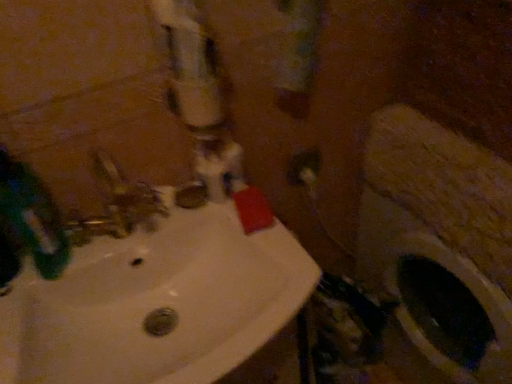
I want to click on white glossy water pipe at upper center, so click(199, 96).

The width and height of the screenshot is (512, 384). Identify the location of white glossy sink at center. (157, 255).

In order to click on white glossy water pipe at upper center in this screenshot , I will do `click(199, 96)`.

Does green matte toothbrush at left lie in front of white glossy sink at center?

No, green matte toothbrush at left is further to the viewer.

Find the location of a particular element. This screenshot has width=512, height=384. sink in front of the green matte toothbrush at left is located at coordinates (157, 255).

Between green matte toothbrush at left and white glossy sink at center, which one has smaller size?

green matte toothbrush at left.

Consider the image. From a real-world perspective, between white glossy water pipe at upper center and white glossy sink at center, who is vertically higher?

A: white glossy water pipe at upper center, from a real-world perspective.

Locate an element on the screen. sink in front of the white glossy water pipe at upper center is located at coordinates (157, 255).

Is point (194, 89) farther from viewer compared to point (199, 220)?

No.

Is white glossy water pipe at upper center inside or outside of white glossy sink at center?

white glossy water pipe at upper center is spatially situated outside white glossy sink at center.

Is matte white outlet at center at the left side of white glossy sink at center?

No.

From the picture: From a real-world perspective, is matte white outlet at center above or below white glossy sink at center?

matte white outlet at center is situated lower than white glossy sink at center in the real world.

Is matte white outlet at center thinner than white glossy sink at center?

Yes.

From a real-world perspective, is white glossy water pipe at upper center physically located above or below matte white outlet at center?

From a real-world perspective, white glossy water pipe at upper center is physically above matte white outlet at center.

Is white glossy water pipe at upper center positioned beyond the bounds of matte white outlet at center?

That's correct, white glossy water pipe at upper center is outside of matte white outlet at center.

At what (x,y) coordinates should I click in order to perform the action: click on electric outlet behind the white glossy water pipe at upper center. Please return your answer as a coordinate pair (x, y). Looking at the image, I should click on (303, 166).

From the image's perspective, relative to matte white outlet at center, is white glossy water pipe at upper center above or below?

white glossy water pipe at upper center is situated higher than matte white outlet at center in the image.

Can you confirm if matte white outlet at center is wider than green matte toothbrush at left?

No.

Does matte white outlet at center have a larger size compared to green matte toothbrush at left?

No.

From a real-world perspective, is matte white outlet at center over green matte toothbrush at left?

No, from a real-world perspective, matte white outlet at center is not above green matte toothbrush at left.

Is matte white outlet at center further to camera compared to green matte toothbrush at left?

Yes, matte white outlet at center is further from the camera.

Consider the image. Is white glossy sink at center with matte white outlet at center?

No, white glossy sink at center is not with matte white outlet at center.

Between white glossy sink at center and matte white outlet at center, which one has larger size?

Bigger between the two is white glossy sink at center.

Does white glossy sink at center have a lesser height compared to matte white outlet at center?

No, white glossy sink at center is not shorter than matte white outlet at center.

How many degrees apart are the facing directions of white glossy sink at center and matte white outlet at center?

The angle between the facing direction of white glossy sink at center and the facing direction of matte white outlet at center is 0.63 degrees.

Between white glossy sink at center and green matte toothbrush at left, which one appears on the right side from the viewer's perspective?

white glossy sink at center is more to the right.

Which point is more forward, (223, 359) or (57, 220)?

Positioned in front is point (223, 359).

Would you say white glossy sink at center is outside green matte toothbrush at left?

Indeed, white glossy sink at center is completely outside green matte toothbrush at left.

Is the surface of white glossy sink at center in direct contact with green matte toothbrush at left?

white glossy sink at center is not next to green matte toothbrush at left, and they're not touching.

Where is `mouthwash to the left of white glossy sink at center`? This screenshot has height=384, width=512. mouthwash to the left of white glossy sink at center is located at coordinates (32, 216).

Locate an element on the screen. sink below the white glossy water pipe at upper center (from the image's perspective) is located at coordinates (157, 255).

From the image, which object appears to be nearer to matte white outlet at center, white glossy sink at center or green matte toothbrush at left?

white glossy sink at center.

From the image, which object appears to be nearer to white glossy water pipe at upper center, matte white outlet at center or green matte toothbrush at left?

The object closer to white glossy water pipe at upper center is green matte toothbrush at left.

When comparing their distances from white glossy water pipe at upper center, does green matte toothbrush at left or white glossy sink at center seem further?

green matte toothbrush at left lies further to white glossy water pipe at upper center than the other object.

From the image, which object appears to be farther from green matte toothbrush at left, white glossy sink at center or white glossy water pipe at upper center?

Among the two, white glossy water pipe at upper center is located further to green matte toothbrush at left.

Looking at the image, which one is located closer to matte white outlet at center, green matte toothbrush at left or white glossy water pipe at upper center?

Based on the image, white glossy water pipe at upper center appears to be nearer to matte white outlet at center.

Considering their positions, is white glossy sink at center positioned closer to white glossy water pipe at upper center than green matte toothbrush at left?

white glossy sink at center is closer to white glossy water pipe at upper center.

Looking at this image, estimate the real-world distances between objects in this image. Which object is closer to white glossy water pipe at upper center, green matte toothbrush at left or matte white outlet at center?

green matte toothbrush at left is closer to white glossy water pipe at upper center.

Based on their spatial positions, is white glossy water pipe at upper center or matte white outlet at center closer to white glossy sink at center?

The object closer to white glossy sink at center is white glossy water pipe at upper center.

Where is `water pipe between white glossy sink at center and matte white outlet at center from front to back`? Image resolution: width=512 pixels, height=384 pixels. water pipe between white glossy sink at center and matte white outlet at center from front to back is located at coordinates (199, 96).

The height and width of the screenshot is (384, 512). I want to click on mouthwash positioned between white glossy water pipe at upper center and matte white outlet at center from near to far, so click(32, 216).

Locate an element on the screen. mouthwash located between white glossy sink at center and matte white outlet at center in the depth direction is located at coordinates (32, 216).

Find the location of `mouthwash between white glossy water pipe at upper center and white glossy sink at center from top to bottom`. mouthwash between white glossy water pipe at upper center and white glossy sink at center from top to bottom is located at coordinates pos(32,216).